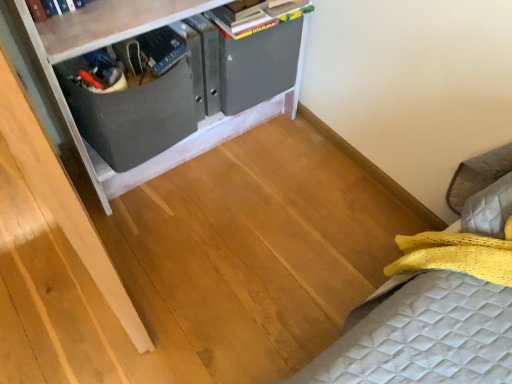
Question: From the image's perspective, does matte black drawer at center appear lower than hardcover book at upper center?

Choices:
 (A) no
 (B) yes

Answer: (B)

Question: Does matte black drawer at center have a lesser height compared to hardcover book at upper center?

Choices:
 (A) no
 (B) yes

Answer: (A)

Question: Is matte black drawer at center beside hardcover book at upper center?

Choices:
 (A) no
 (B) yes

Answer: (A)

Question: Is matte black drawer at center closer to the viewer compared to hardcover book at upper center?

Choices:
 (A) yes
 (B) no

Answer: (A)

Question: From the image's perspective, does matte black drawer at center appear higher than hardcover book at upper center?

Choices:
 (A) yes
 (B) no

Answer: (B)

Question: Can you confirm if matte black drawer at center is thinner than hardcover book at upper center?

Choices:
 (A) yes
 (B) no

Answer: (B)

Question: Does matte black drawer at center turn towards matte gray cabinet at upper left?

Choices:
 (A) no
 (B) yes

Answer: (B)

Question: Does matte black drawer at center have a lesser height compared to matte gray cabinet at upper left?

Choices:
 (A) no
 (B) yes

Answer: (B)

Question: Is matte black drawer at center looking in the opposite direction of matte gray cabinet at upper left?

Choices:
 (A) yes
 (B) no

Answer: (A)

Question: Is matte black drawer at center far from matte gray cabinet at upper left?

Choices:
 (A) no
 (B) yes

Answer: (A)

Question: Is the depth of matte black drawer at center greater than that of matte gray cabinet at upper left?

Choices:
 (A) no
 (B) yes

Answer: (B)

Question: Does matte black drawer at center have a greater width compared to matte gray cabinet at upper left?

Choices:
 (A) no
 (B) yes

Answer: (A)

Question: Is matte gray cabinet at upper left facing towards matte black drawer at center?

Choices:
 (A) yes
 (B) no

Answer: (A)